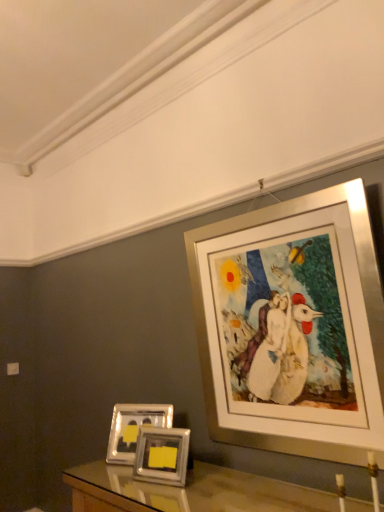
Question: In terms of width, does silver metallic photo frames at lower center, the 2th picture frame viewed from the right, look wider or thinner when compared to silver metallic picture frame at upper right, marked as the 3th picture frame in a left-to-right arrangement?

Choices:
 (A) wide
 (B) thin

Answer: (B)

Question: From the image's perspective, is silver metallic photo frames at lower center, placed as the second picture frame when sorted from left to right, positioned above or below silver metallic picture frame at upper right, marked as the 3th picture frame in a left-to-right arrangement?

Choices:
 (A) below
 (B) above

Answer: (A)

Question: Which object is positioned closest to the metallic silver picture frame at lower left, the 1th picture frame positioned from the left?

Choices:
 (A) silver metallic picture frame at upper right, the 1th picture frame in the right-to-left sequence
 (B) silver metallic photo frames at lower center, the 2th picture frame viewed from the right

Answer: (B)

Question: Which object is the farthest from the metallic silver picture frame at lower left, the 1th picture frame positioned from the left?

Choices:
 (A) silver metallic photo frames at lower center, the 2th picture frame viewed from the right
 (B) silver metallic picture frame at upper right, marked as the 3th picture frame in a left-to-right arrangement

Answer: (B)